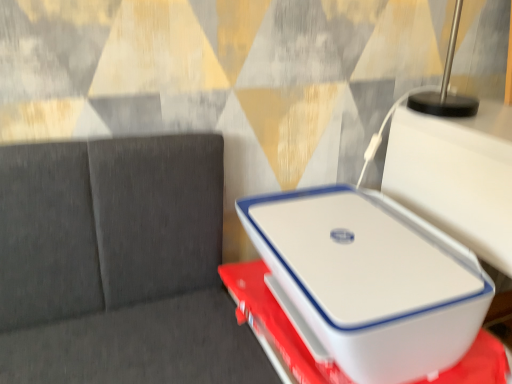
Measure the distance between white plastic container at center and camera.

They are 23.23 inches apart.

Where is `white plastic container at center`? The width and height of the screenshot is (512, 384). white plastic container at center is located at coordinates (274, 322).

The width and height of the screenshot is (512, 384). Describe the element at coordinates (274, 322) in the screenshot. I see `white plastic container at center` at that location.

The width and height of the screenshot is (512, 384). I want to click on white plastic laptop at center, so click(x=359, y=256).

Describe the element at coordinates (359, 256) in the screenshot. The image size is (512, 384). I see `white plastic laptop at center` at that location.

This screenshot has width=512, height=384. In order to click on white plastic container at center in this screenshot , I will do `click(274, 322)`.

Considering the positions of objects white plastic container at center and white plastic laptop at center in the image provided, who is more to the left, white plastic container at center or white plastic laptop at center?

white plastic laptop at center.

Looking at this image, does white plastic container at center lie behind white plastic laptop at center?

No.

From the picture: Which is closer to the camera, (273, 337) or (345, 256)?

The point (345, 256) is more forward.

From the image's perspective, would you say white plastic container at center is shown under white plastic laptop at center?

Yes, from the image's perspective, white plastic container at center is below white plastic laptop at center.

From a real-world perspective, is white plastic container at center physically below white plastic laptop at center?

Yes, from a real-world perspective, white plastic container at center is beneath white plastic laptop at center.

Is white plastic container at center thinner than white plastic laptop at center?

In fact, white plastic container at center might be wider than white plastic laptop at center.

Which of these two, white plastic container at center or white plastic laptop at center, stands shorter?

Standing shorter between the two is white plastic container at center.

Considering the relative sizes of white plastic container at center and white plastic laptop at center in the image provided, is white plastic container at center smaller than white plastic laptop at center?

Yes, white plastic container at center is smaller than white plastic laptop at center.

Is white plastic container at center located outside white plastic laptop at center?

Absolutely, white plastic container at center is external to white plastic laptop at center.

Is white plastic container at center positioned far away from white plastic laptop at center?

No, there isn't a large distance between white plastic container at center and white plastic laptop at center.

Is white plastic container at center facing away from white plastic laptop at center?

No, white plastic container at center's orientation is not away from white plastic laptop at center.

How different are the orientations of white plastic container at center and white plastic laptop at center in degrees?

99.1 degrees separate the facing orientations of white plastic container at center and white plastic laptop at center.

Locate an element on the screen. The width and height of the screenshot is (512, 384). furniture located below the white plastic laptop at center (from the image's perspective) is located at coordinates (274, 322).

Considering the relative positions of white plastic laptop at center and white plastic container at center in the image provided, is white plastic laptop at center to the left of white plastic container at center from the viewer's perspective?

Yes, white plastic laptop at center is to the left of white plastic container at center.

Considering the relative positions of white plastic laptop at center and white plastic container at center in the image provided, is white plastic laptop at center behind white plastic container at center?

Yes, white plastic laptop at center is behind white plastic container at center.

Is point (352, 323) more distant than point (306, 353)?

No, (352, 323) is closer to viewer.

From the image's perspective, which one is positioned lower, white plastic laptop at center or white plastic container at center?

white plastic container at center is shown below in the image.

From a real-world perspective, between white plastic laptop at center and white plastic container at center, who is vertically higher?

white plastic laptop at center, from a real-world perspective.

Can you confirm if white plastic laptop at center is wider than white plastic container at center?

Incorrect, the width of white plastic laptop at center does not surpass that of white plastic container at center.

From the picture: Who is taller, white plastic laptop at center or white plastic container at center?

white plastic laptop at center.

Considering the sizes of white plastic laptop at center and white plastic container at center in the image, is white plastic laptop at center bigger or smaller than white plastic container at center?

Clearly, white plastic laptop at center is larger in size than white plastic container at center.

Is white plastic laptop at center not inside white plastic container at center?

Indeed, white plastic laptop at center is completely outside white plastic container at center.

Is there a large distance between white plastic laptop at center and white plastic container at center?

No, white plastic laptop at center is in close proximity to white plastic container at center.

Is white plastic laptop at center oriented towards white plastic container at center?

No, white plastic laptop at center is not oriented towards white plastic container at center.

Based on the photo, can you tell me how much white plastic laptop at center and white plastic container at center differ in facing direction?

The facing directions of white plastic laptop at center and white plastic container at center are 99.1 degrees apart.

Image resolution: width=512 pixels, height=384 pixels. Identify the location of furniture in front of the white plastic laptop at center. (274, 322).

Where is `furniture below the white plastic laptop at center (from a real-world perspective)`? furniture below the white plastic laptop at center (from a real-world perspective) is located at coordinates (274, 322).

Find the location of `laptop that is on the left side of white plastic container at center`. laptop that is on the left side of white plastic container at center is located at coordinates (359, 256).